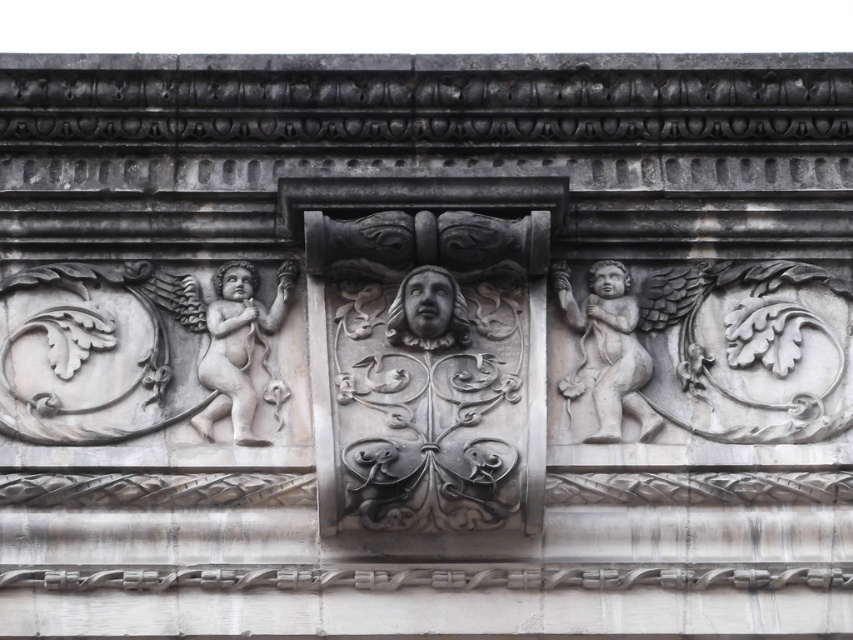
Question: Which object is the farthest from the white stone cherub at center?

Choices:
 (A) gray stone face at center
 (B) white stone cherub at left

Answer: (B)

Question: Is white stone cherub at center below gray stone face at center?

Choices:
 (A) yes
 (B) no

Answer: (B)

Question: Which point is closer to the camera?

Choices:
 (A) (630, 333)
 (B) (422, 346)
 (C) (225, 394)

Answer: (B)

Question: Where is white stone cherub at left located in relation to gray stone face at center in the image?

Choices:
 (A) right
 (B) left

Answer: (B)

Question: Does white stone cherub at left lie behind gray stone face at center?

Choices:
 (A) yes
 (B) no

Answer: (A)

Question: Considering the real-world distances, which object is closest to the gray stone face at center?

Choices:
 (A) white stone cherub at center
 (B) white stone cherub at left

Answer: (B)